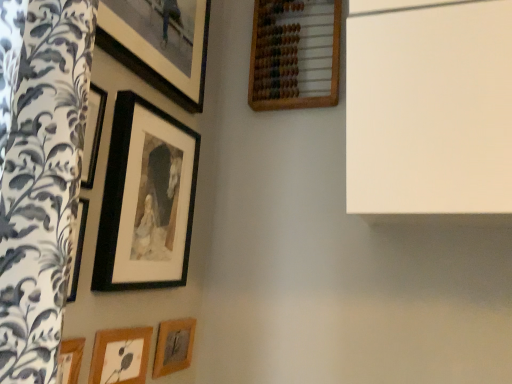
I want to click on wooden abacus at upper center, the 1th picture frame viewed from the right, so click(x=294, y=55).

The height and width of the screenshot is (384, 512). I want to click on matte black picture frame at upper left, the 3th picture frame positioned from the left, so click(x=157, y=56).

This screenshot has height=384, width=512. What do you see at coordinates (173, 346) in the screenshot?
I see `wooden picture frame at lower center, acting as the second picture frame starting from the right` at bounding box center [173, 346].

Locate an element on the screen. The height and width of the screenshot is (384, 512). black matte picture frame at upper left, marked as the second picture frame in a left-to-right arrangement is located at coordinates (146, 199).

From the image's perspective, who appears lower, black matte picture frame at upper left, marked as the second picture frame in a left-to-right arrangement, or wooden abacus at upper center, placed as the 5th picture frame when sorted from left to right?

black matte picture frame at upper left, marked as the second picture frame in a left-to-right arrangement, appears lower in the image.

Is black matte picture frame at upper left, marked as the second picture frame in a left-to-right arrangement, to the right of wooden abacus at upper center, the 1th picture frame viewed from the right, from the viewer's perspective?

Incorrect, black matte picture frame at upper left, marked as the second picture frame in a left-to-right arrangement, is not on the right side of wooden abacus at upper center, the 1th picture frame viewed from the right.

Does point (133, 157) lie behind point (281, 55)?

That is False.

Is wooden picture frame at lower center, marked as the fourth picture frame in a left-to-right arrangement, positioned with its back to matte black picture frame at upper left, the 3th picture frame positioned from the left?

No, wooden picture frame at lower center, marked as the fourth picture frame in a left-to-right arrangement,'s orientation is not away from matte black picture frame at upper left, the 3th picture frame positioned from the left.

Is wooden picture frame at lower center, marked as the fourth picture frame in a left-to-right arrangement, at the right side of matte black picture frame at upper left, which is counted as the 3th picture frame, starting from the right?

Yes, wooden picture frame at lower center, marked as the fourth picture frame in a left-to-right arrangement, is to the right of matte black picture frame at upper left, which is counted as the 3th picture frame, starting from the right.

From the image's perspective, is wooden picture frame at lower center, acting as the second picture frame starting from the right, located beneath matte black picture frame at upper left, which is counted as the 3th picture frame, starting from the right?

Correct, wooden picture frame at lower center, acting as the second picture frame starting from the right, appears lower than matte black picture frame at upper left, which is counted as the 3th picture frame, starting from the right, in the image.

From a real-world perspective, is wooden picture frame at lower center, acting as the second picture frame starting from the right, over matte black picture frame at upper left, which is counted as the 3th picture frame, starting from the right?

No, from a real-world perspective, wooden picture frame at lower center, acting as the second picture frame starting from the right, is not over matte black picture frame at upper left, which is counted as the 3th picture frame, starting from the right

How distant is wooden picture frame at lower center, acting as the second picture frame starting from the right, from wooden abacus at upper center, the 1th picture frame viewed from the right?

wooden picture frame at lower center, acting as the second picture frame starting from the right, and wooden abacus at upper center, the 1th picture frame viewed from the right, are 33.26 inches apart.

Is point (169, 332) closer to camera compared to point (284, 6)?

Yes, point (169, 332) is in front of point (284, 6).

Would you consider wooden picture frame at lower center, marked as the fourth picture frame in a left-to-right arrangement, to be distant from wooden abacus at upper center, placed as the 5th picture frame when sorted from left to right?

wooden picture frame at lower center, marked as the fourth picture frame in a left-to-right arrangement, is near wooden abacus at upper center, placed as the 5th picture frame when sorted from left to right, not far away.

Can you tell me how much wooden picture frame at lower center, acting as the second picture frame starting from the right, and wooden abacus at upper center, the 1th picture frame viewed from the right, differ in facing direction?

There is a 88.6-degree angle between the facing directions of wooden picture frame at lower center, acting as the second picture frame starting from the right, and wooden abacus at upper center, the 1th picture frame viewed from the right.

Considering the sizes of objects black matte picture frame at upper left, marked as the second picture frame in a left-to-right arrangement, and wooden picture frame at lower center, acting as the second picture frame starting from the right, in the image provided, who is thinner, black matte picture frame at upper left, marked as the second picture frame in a left-to-right arrangement, or wooden picture frame at lower center, acting as the second picture frame starting from the right,?

Thinner between the two is wooden picture frame at lower center, acting as the second picture frame starting from the right.

Between black matte picture frame at upper left, marked as the second picture frame in a left-to-right arrangement, and wooden picture frame at lower center, marked as the fourth picture frame in a left-to-right arrangement, which one has larger size?

Bigger between the two is black matte picture frame at upper left, marked as the second picture frame in a left-to-right arrangement.

Is black matte picture frame at upper left, marked as the second picture frame in a left-to-right arrangement, placed right next to wooden picture frame at lower center, acting as the second picture frame starting from the right?

There is a gap between black matte picture frame at upper left, marked as the second picture frame in a left-to-right arrangement, and wooden picture frame at lower center, acting as the second picture frame starting from the right.

From a real-world perspective, which object rests below the other?

wooden picture frame at lower center, acting as the second picture frame starting from the right, is physically lower.

Between point (159, 339) and point (94, 270), which one is positioned in front?

The point (94, 270) is in front.

Is wooden picture frame at lower center, acting as the second picture frame starting from the right, not inside black matte picture frame at upper left, marked as the second picture frame in a left-to-right arrangement?

wooden picture frame at lower center, acting as the second picture frame starting from the right, lies outside black matte picture frame at upper left, marked as the second picture frame in a left-to-right arrangement,'s area.

Is wooden picture frame at lower center, marked as the fourth picture frame in a left-to-right arrangement, not inside wooden picture frame at lower left, the first picture frame viewed from the left?

Yes, wooden picture frame at lower center, marked as the fourth picture frame in a left-to-right arrangement, is not within wooden picture frame at lower left, the first picture frame viewed from the left.

Based on the photo, who is taller, wooden picture frame at lower center, marked as the fourth picture frame in a left-to-right arrangement, or wooden picture frame at lower left, placed as the fifth picture frame when sorted from right to left?

wooden picture frame at lower center, marked as the fourth picture frame in a left-to-right arrangement.

Is the depth of wooden picture frame at lower left, placed as the fifth picture frame when sorted from right to left, greater than that of wooden picture frame at lower center, acting as the second picture frame starting from the right?

No, the depth of wooden picture frame at lower left, placed as the fifth picture frame when sorted from right to left, is less than that of wooden picture frame at lower center, acting as the second picture frame starting from the right.

From the image's perspective, which picture frame is the 1st one above the wooden picture frame at lower center, marked as the fourth picture frame in a left-to-right arrangement? Please provide its 2D coordinates.

[(120, 356)]

Considering the sizes of objects wooden picture frame at lower left, placed as the fifth picture frame when sorted from right to left, and wooden picture frame at lower center, acting as the second picture frame starting from the right, in the image provided, who is wider, wooden picture frame at lower left, placed as the fifth picture frame when sorted from right to left, or wooden picture frame at lower center, acting as the second picture frame starting from the right,?

wooden picture frame at lower center, acting as the second picture frame starting from the right.

Is point (146, 348) more distant than point (173, 328)?

No, it is in front of (173, 328).

Locate an element on the screen. The image size is (512, 384). the 3rd picture frame counting from the left side of the wooden abacus at upper center, placed as the 5th picture frame when sorted from left to right is located at coordinates (146, 199).

You are a GUI agent. You are given a task and a screenshot of the screen. Output one action in this format:
    pyautogui.click(x=<x>, y=<y>)
    Task: Click on the 3rd picture frame above the wooden picture frame at lower center, marked as the fourth picture frame in a left-to-right arrangement (from the image's perspective)
    
    Given the screenshot: What is the action you would take?
    pyautogui.click(x=157, y=56)

Considering their positions, is wooden picture frame at lower left, the first picture frame viewed from the left, positioned further to wooden picture frame at lower center, marked as the fourth picture frame in a left-to-right arrangement, than matte black picture frame at upper left, which is counted as the 3th picture frame, starting from the right?

matte black picture frame at upper left, which is counted as the 3th picture frame, starting from the right, is further to wooden picture frame at lower center, marked as the fourth picture frame in a left-to-right arrangement.

When comparing their distances from wooden picture frame at lower center, marked as the fourth picture frame in a left-to-right arrangement, does matte black picture frame at upper left, which is counted as the 3th picture frame, starting from the right, or wooden picture frame at lower left, placed as the fifth picture frame when sorted from right to left, seem further?

Among the two, matte black picture frame at upper left, which is counted as the 3th picture frame, starting from the right, is located further to wooden picture frame at lower center, marked as the fourth picture frame in a left-to-right arrangement.

Which object lies nearer to the anchor point matte black picture frame at upper left, the 3th picture frame positioned from the left, black matte picture frame at upper left, marked as the second picture frame in a left-to-right arrangement, or wooden picture frame at lower left, placed as the fifth picture frame when sorted from right to left?

black matte picture frame at upper left, marked as the second picture frame in a left-to-right arrangement, lies closer to matte black picture frame at upper left, the 3th picture frame positioned from the left, than the other object.

Considering their positions, is matte black picture frame at upper left, the 3th picture frame positioned from the left, positioned closer to wooden picture frame at lower left, placed as the fifth picture frame when sorted from right to left, than wooden abacus at upper center, the 1th picture frame viewed from the right?

The object closer to wooden picture frame at lower left, placed as the fifth picture frame when sorted from right to left, is matte black picture frame at upper left, the 3th picture frame positioned from the left.

Which object lies further to the anchor point matte black picture frame at upper left, which is counted as the 3th picture frame, starting from the right, wooden abacus at upper center, placed as the 5th picture frame when sorted from left to right, or wooden picture frame at lower left, the first picture frame viewed from the left?

wooden picture frame at lower left, the first picture frame viewed from the left, is further to matte black picture frame at upper left, which is counted as the 3th picture frame, starting from the right.

Which object lies further to the anchor point black matte picture frame at upper left, the fourth picture frame from the right, matte black picture frame at upper left, the 3th picture frame positioned from the left, or wooden picture frame at lower left, the first picture frame viewed from the left?

Among the two, wooden picture frame at lower left, the first picture frame viewed from the left, is located further to black matte picture frame at upper left, the fourth picture frame from the right.

From the image, which object appears to be nearer to black matte picture frame at upper left, marked as the second picture frame in a left-to-right arrangement, wooden picture frame at lower left, the first picture frame viewed from the left, or wooden picture frame at lower center, marked as the fourth picture frame in a left-to-right arrangement?

wooden picture frame at lower left, the first picture frame viewed from the left.

Based on their spatial positions, is wooden picture frame at lower left, placed as the fifth picture frame when sorted from right to left, or black matte picture frame at upper left, marked as the second picture frame in a left-to-right arrangement, closer to wooden abacus at upper center, the 1th picture frame viewed from the right?

black matte picture frame at upper left, marked as the second picture frame in a left-to-right arrangement, is closer to wooden abacus at upper center, the 1th picture frame viewed from the right.

Image resolution: width=512 pixels, height=384 pixels. In order to click on picture frame between black matte picture frame at upper left, marked as the second picture frame in a left-to-right arrangement, and wooden picture frame at lower center, marked as the fourth picture frame in a left-to-right arrangement, in the up-down direction in this screenshot , I will do (120, 356).

Where is `picture frame that lies between matte black picture frame at upper left, the 3th picture frame positioned from the left, and wooden picture frame at lower left, the first picture frame viewed from the left, from top to bottom`? The image size is (512, 384). picture frame that lies between matte black picture frame at upper left, the 3th picture frame positioned from the left, and wooden picture frame at lower left, the first picture frame viewed from the left, from top to bottom is located at coordinates (146, 199).

You are a GUI agent. You are given a task and a screenshot of the screen. Output one action in this format:
    pyautogui.click(x=<x>, y=<y>)
    Task: Click on the picture frame between wooden abacus at upper center, placed as the 5th picture frame when sorted from left to right, and black matte picture frame at upper left, marked as the second picture frame in a left-to-right arrangement, vertically
    The width and height of the screenshot is (512, 384).
    Given the screenshot: What is the action you would take?
    pyautogui.click(x=157, y=56)